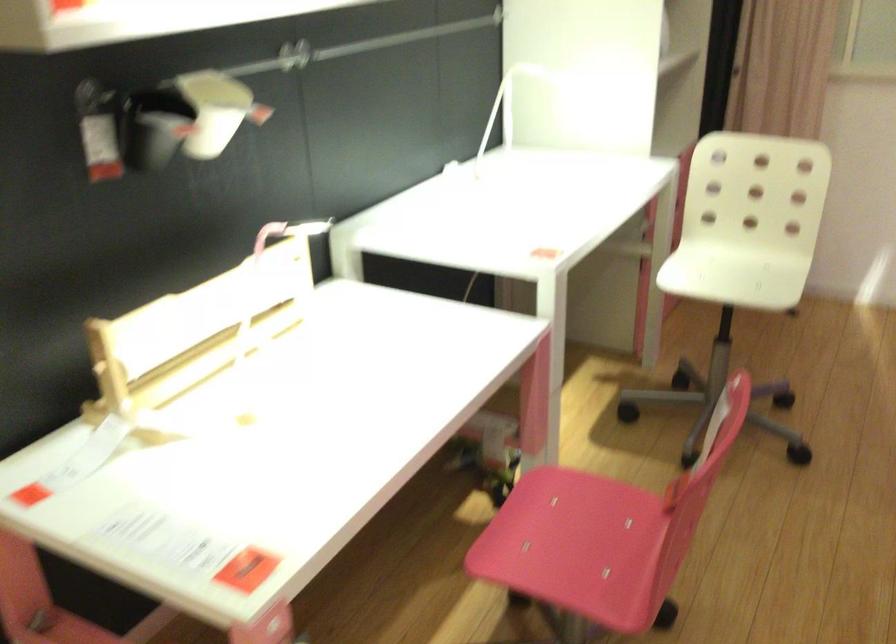
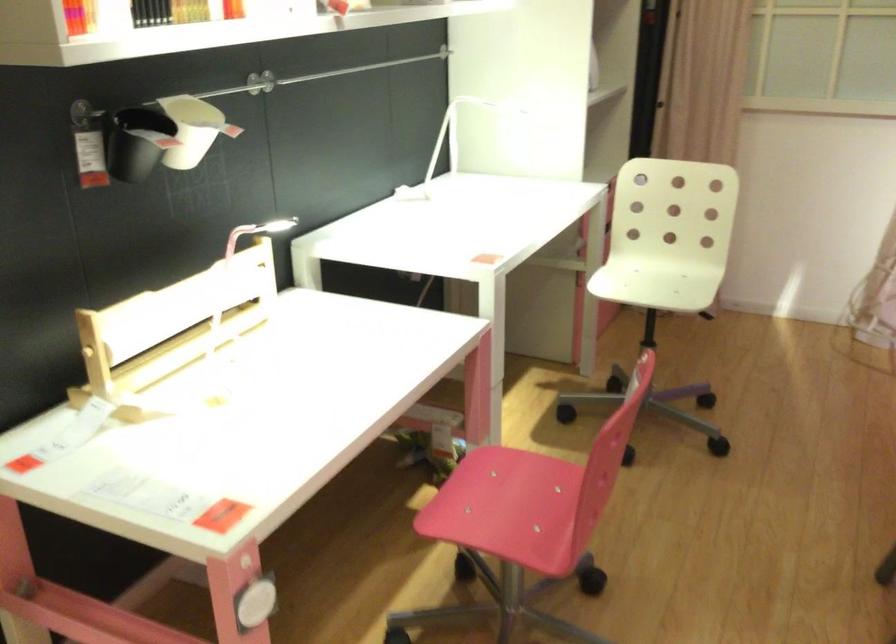
In the second image, find the point that corresponds to the point at 745,267 in the first image.

(668, 277)